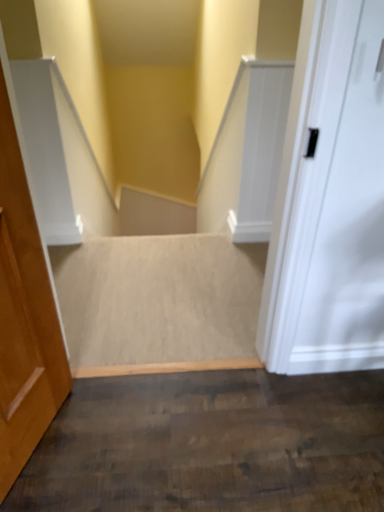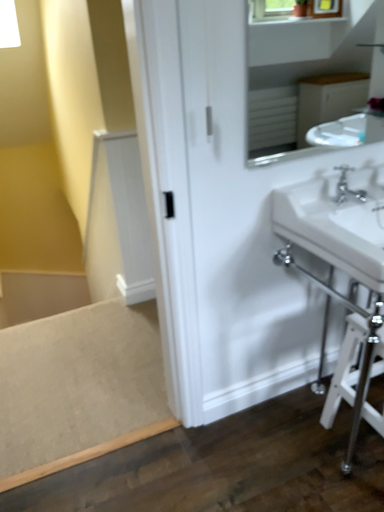
Question: How did the camera likely rotate when shooting the video?

Choices:
 (A) rotated right
 (B) rotated left

Answer: (A)